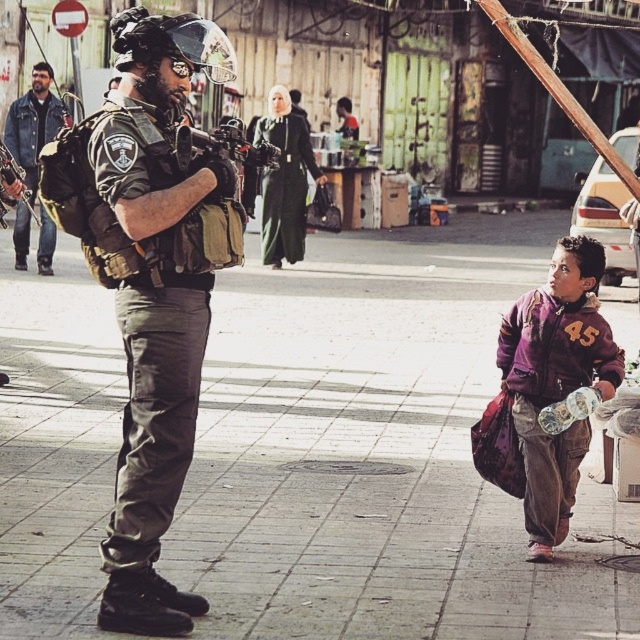
Consider the image. Who is lower down, camouflage uniform at center or purple fleece jacket at lower right?

Positioned lower is purple fleece jacket at lower right.

Identify the location of camouflage uniform at center. (157, 292).

Is point (211, 51) positioned after point (548, 394)?

No.

This screenshot has height=640, width=640. Identify the location of camouflage uniform at center. (157, 292).

Which is behind, point (141, 520) or point (4, 164)?

Point (4, 164)

Which is more to the left, camouflage uniform at center or matte black rifle at left?

matte black rifle at left is more to the left.

Is point (125, 26) positioned before point (6, 164)?

Yes, it is in front of point (6, 164).

Locate an element on the screen. camouflage uniform at center is located at coordinates (157, 292).

Between denim jacket at left and matte black rifle at left, which one appears on the left side from the viewer's perspective?

denim jacket at left is more to the left.

Is point (33, 83) positioned in front of point (10, 166)?

No.

This screenshot has height=640, width=640. Identify the location of denim jacket at left. (33, 124).